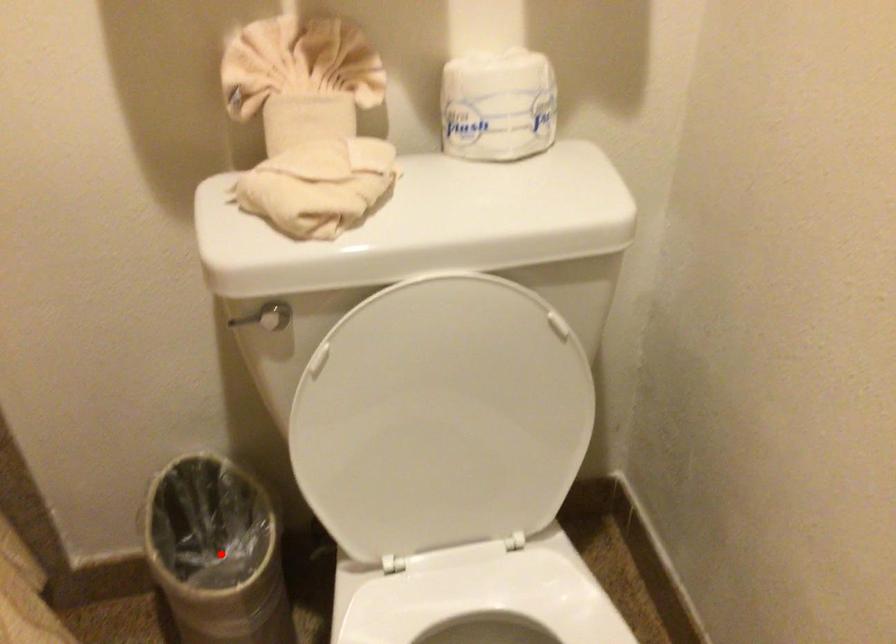
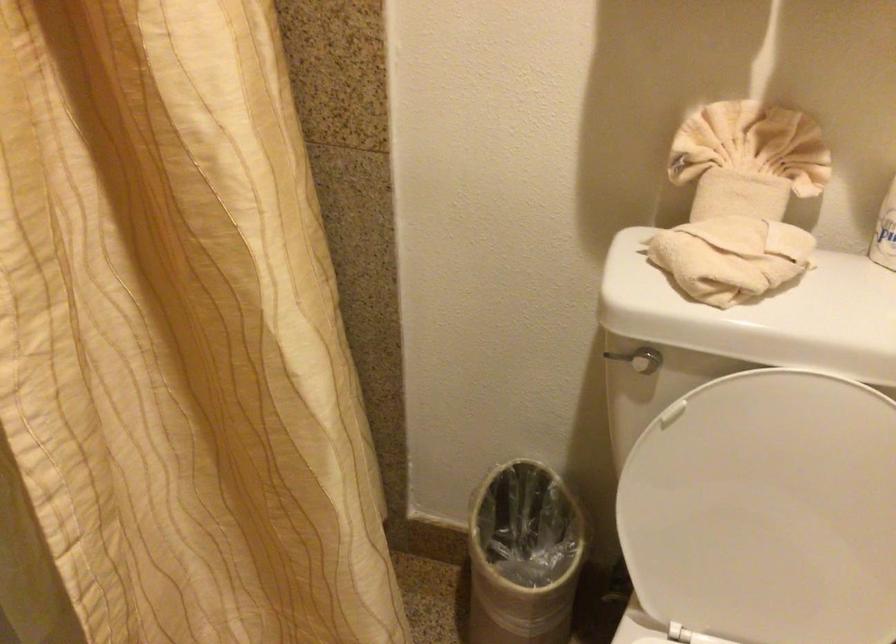
The point at the highlighted location is marked in the first image. Where is the corresponding point in the second image?

(522, 556)